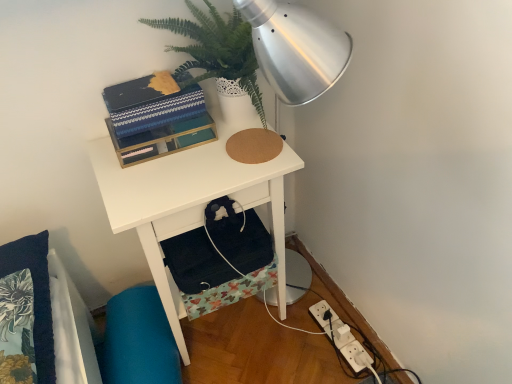
The height and width of the screenshot is (384, 512). What are the coordinates of `vacant space situated above white matte desk at center (from a real-world perspective)` in the screenshot? It's located at (198, 156).